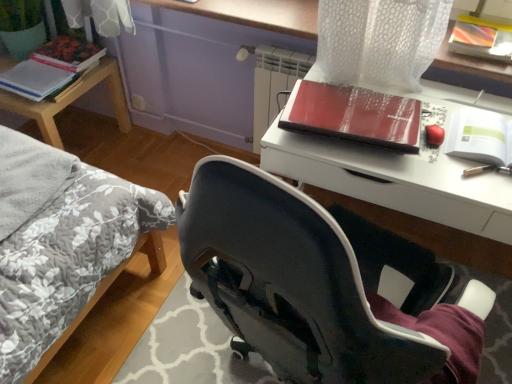
This screenshot has height=384, width=512. Find the location of `matte hardcover book at upper left, the 2th paperback book when ordered from left to right`. matte hardcover book at upper left, the 2th paperback book when ordered from left to right is located at coordinates (68, 53).

Measure the distance between point (376, 106) and camera.

A distance of 1.33 meters exists between point (376, 106) and camera.

You are a GUI agent. You are given a task and a screenshot of the screen. Output one action in this format:
    pyautogui.click(x=<x>, y=<y>)
    Task: Click on the matte hardcover book at upper left, the third paperback book from the front
    The width and height of the screenshot is (512, 384).
    Given the screenshot: What is the action you would take?
    pyautogui.click(x=68, y=53)

Locate an element on the screen. desk below the green matte paperback book at upper right, the first paperback book from the bottom (from a real-world perspective) is located at coordinates (404, 194).

Is green matte paperback book at upper right, acting as the first paperback book starting from the front, at the back of matte black desk at upper right?

matte black desk at upper right does not have its back to green matte paperback book at upper right, acting as the first paperback book starting from the front.

Does matte black desk at upper right appear on the left side of green matte paperback book at upper right, acting as the first paperback book starting from the front?

Correct, you'll find matte black desk at upper right to the left of green matte paperback book at upper right, acting as the first paperback book starting from the front.

From the image's perspective, is matte black desk at upper right on top of green matte paperback book at upper right, positioned as the third paperback book in top-to-bottom order?

Actually, matte black desk at upper right appears below green matte paperback book at upper right, positioned as the third paperback book in top-to-bottom order, in the image.

Considering the points (45, 131) and (54, 65), which point is in front, point (45, 131) or point (54, 65)?

Positioned in front is point (45, 131).

Looking at this image, is woodenmaterial/texturetable at left not within matte hardcover book at upper left, the 2th paperback book when ordered from left to right?

woodenmaterial/texturetable at left is positioned outside matte hardcover book at upper left, the 2th paperback book when ordered from left to right.

Can you confirm if woodenmaterial/texturetable at left is taller than matte hardcover book at upper left, the 1th paperback book from the back?

Indeed, woodenmaterial/texturetable at left has a greater height compared to matte hardcover book at upper left, the 1th paperback book from the back.

Based on the photo, considering the positions of objects woodenmaterial/texturetable at left and matte hardcover book at upper left, which is the first paperback book in top-to-bottom order, in the image provided, who is more to the right, woodenmaterial/texturetable at left or matte hardcover book at upper left, which is the first paperback book in top-to-bottom order,?

matte hardcover book at upper left, which is the first paperback book in top-to-bottom order.

Is the depth of green matte paperback book at upper right, positioned as the third paperback book in top-to-bottom order, greater than that of shiny red book at upper right?

That is False.

From the image's perspective, relative to shiny red book at upper right, is green matte paperback book at upper right, which ranks as the third paperback book in left-to-right order, above or below?

From the image's perspective, green matte paperback book at upper right, which ranks as the third paperback book in left-to-right order, appears below shiny red book at upper right.

Is green matte paperback book at upper right, the first paperback book from the right, to the right of shiny red book at upper right from the viewer's perspective?

Indeed, green matte paperback book at upper right, the first paperback book from the right, is positioned on the right side of shiny red book at upper right.

Can you confirm if green matte paperback book at upper right, positioned as the third paperback book in top-to-bottom order, is bigger than shiny red book at upper right?

No.

Can you confirm if matte black desk at upper right is thinner than matte paper notebook at left, positioned as the second paperback book in top-to-bottom order?

In fact, matte black desk at upper right might be wider than matte paper notebook at left, positioned as the second paperback book in top-to-bottom order.

Does matte black desk at upper right have a greater height compared to matte paper notebook at left, positioned as the second paperback book in top-to-bottom order?

Indeed, matte black desk at upper right has a greater height compared to matte paper notebook at left, positioned as the second paperback book in top-to-bottom order.

Is matte black desk at upper right behind matte paper notebook at left, positioned as the second paperback book in top-to-bottom order?

No, matte black desk at upper right is in front of matte paper notebook at left, positioned as the second paperback book in top-to-bottom order.

From the image's perspective, is matte black desk at upper right located beneath matte paper notebook at left, placed as the 3th paperback book when sorted from right to left?

Indeed, from the image's perspective, matte black desk at upper right is shown beneath matte paper notebook at left, placed as the 3th paperback book when sorted from right to left.

Is matte paper notebook at left, acting as the 2th paperback book starting from the back, not close to green matte paperback book at upper right, the 3th paperback book positioned from the back?

Yes.

Is matte paper notebook at left, the first paperback book from the left, aimed at green matte paperback book at upper right, acting as the first paperback book starting from the front?

Yes, matte paper notebook at left, the first paperback book from the left, is facing green matte paperback book at upper right, acting as the first paperback book starting from the front.

In the scene shown: What's the angular difference between matte paper notebook at left, acting as the 2th paperback book starting from the back, and green matte paperback book at upper right, acting as the first paperback book starting from the front,'s facing directions?

85.3 degrees.

From the image's perspective, would you say matte paper notebook at left, the first paperback book from the left, is positioned over green matte paperback book at upper right, acting as the first paperback book starting from the front?

Yes.

In the image, is matte paper notebook at left, placed as the 3th paperback book when sorted from right to left, on the left side or the right side of matte black desk at upper right?

Clearly, matte paper notebook at left, placed as the 3th paperback book when sorted from right to left, is on the left of matte black desk at upper right in the image.

From the image's perspective, relative to matte black desk at upper right, is matte paper notebook at left, acting as the 2th paperback book starting from the back, above or below?

From the image's perspective, matte paper notebook at left, acting as the 2th paperback book starting from the back, appears above matte black desk at upper right.

Is the surface of matte paper notebook at left, placed as the 2th paperback book when sorted from front to back, in direct contact with matte black desk at upper right?

matte paper notebook at left, placed as the 2th paperback book when sorted from front to back, and matte black desk at upper right are not in contact.

Is woodenmaterial/texturetable at left positioned far away from shiny red book at upper right?

Indeed, woodenmaterial/texturetable at left is not near shiny red book at upper right.

Could you tell me if woodenmaterial/texturetable at left is facing shiny red book at upper right?

No, woodenmaterial/texturetable at left is not oriented towards shiny red book at upper right.

Is woodenmaterial/texturetable at left further to the viewer compared to shiny red book at upper right?

Yes, it is.

Measure the distance between woodenmaterial/texturetable at left and shiny red book at upper right.

woodenmaterial/texturetable at left is 4.43 feet away from shiny red book at upper right.

The width and height of the screenshot is (512, 384). In order to click on the 1st paperback book behind the matte black desk at upper right, starting your count from the anchor in this screenshot , I will do `click(479, 137)`.

Find the location of a particular element. This screenshot has width=512, height=384. the 2nd paperback book above the woodenmaterial/texturetable at left (from the image's perspective) is located at coordinates (68, 53).

Considering their positions, is matte hardcover book at upper left, which is counted as the 2th paperback book, starting from the right, positioned closer to matte black desk at upper right than woodenmaterial/texturetable at left?

Based on the image, woodenmaterial/texturetable at left appears to be nearer to matte black desk at upper right.

Based on their spatial positions, is shiny red book at upper right or green matte paperback book at upper right, positioned as the third paperback book in top-to-bottom order, closer to matte paper notebook at left, marked as the 2th paperback book in a bottom-to-top arrangement?

shiny red book at upper right is positioned closer to the anchor matte paper notebook at left, marked as the 2th paperback book in a bottom-to-top arrangement.

Based on their spatial positions, is shiny red book at upper right or woodenmaterial/texturetable at left closer to matte hardcover book at upper left, the third paperback book from the front?

Among the two, woodenmaterial/texturetable at left is located nearer to matte hardcover book at upper left, the third paperback book from the front.

Estimate the real-world distances between objects in this image. Which object is closer to green matte paperback book at upper right, the first paperback book from the bottom, matte black desk at upper right or woodenmaterial/texturetable at left?

matte black desk at upper right is positioned closer to the anchor green matte paperback book at upper right, the first paperback book from the bottom.

Which object lies further to the anchor point matte paper notebook at left, placed as the 3th paperback book when sorted from right to left, shiny red book at upper right or woodenmaterial/texturetable at left?

shiny red book at upper right is positioned further to the anchor matte paper notebook at left, placed as the 3th paperback book when sorted from right to left.

Based on their spatial positions, is green matte paperback book at upper right, the first paperback book from the bottom, or shiny red book at upper right closer to matte paper notebook at left, positioned as the second paperback book in top-to-bottom order?

Among the two, shiny red book at upper right is located nearer to matte paper notebook at left, positioned as the second paperback book in top-to-bottom order.

When comparing their distances from shiny red book at upper right, does matte hardcover book at upper left, which is the first paperback book in top-to-bottom order, or green matte paperback book at upper right, which ranks as the third paperback book in left-to-right order, seem closer?

The object closer to shiny red book at upper right is green matte paperback book at upper right, which ranks as the third paperback book in left-to-right order.

Based on their spatial positions, is shiny red book at upper right or matte black desk at upper right closer to matte hardcover book at upper left, which is the first paperback book in top-to-bottom order?

shiny red book at upper right.

The height and width of the screenshot is (384, 512). Find the location of `book between matte hardcover book at upper left, which is the first paperback book in top-to-bottom order, and matte black desk at upper right`. book between matte hardcover book at upper left, which is the first paperback book in top-to-bottom order, and matte black desk at upper right is located at coordinates (354, 115).

Where is `desk between shiny red book at upper right and green matte paperback book at upper right, which ranks as the third paperback book in left-to-right order`? The image size is (512, 384). desk between shiny red book at upper right and green matte paperback book at upper right, which ranks as the third paperback book in left-to-right order is located at coordinates (404, 194).

What are the coordinates of `paperback book between matte hardcover book at upper left, acting as the third paperback book starting from the bottom, and woodenmaterial/texturetable at left in the up-down direction` in the screenshot? It's located at (34, 79).

Locate an element on the screen. book situated between woodenmaterial/texturetable at left and green matte paperback book at upper right, acting as the first paperback book starting from the front, from left to right is located at coordinates (354, 115).